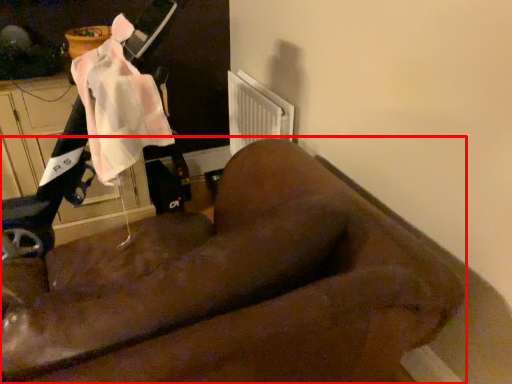
Question: From the image's perspective, what is the correct spatial positioning of furniture (annotated by the red box) in reference to mobility scooter?

Choices:
 (A) above
 (B) below

Answer: (B)